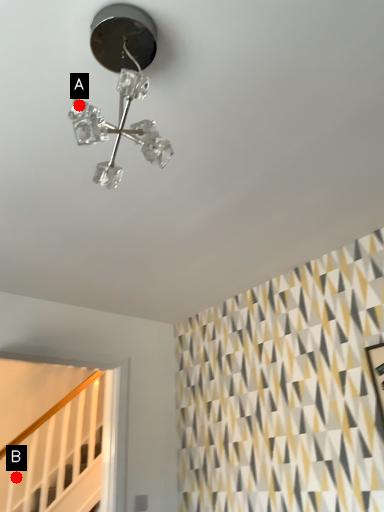
Question: Two points are circled on the image, labeled by A and B beside each circle. Which point is farther from the camera taking this photo?

Choices:
 (A) A is further
 (B) B is further

Answer: (B)